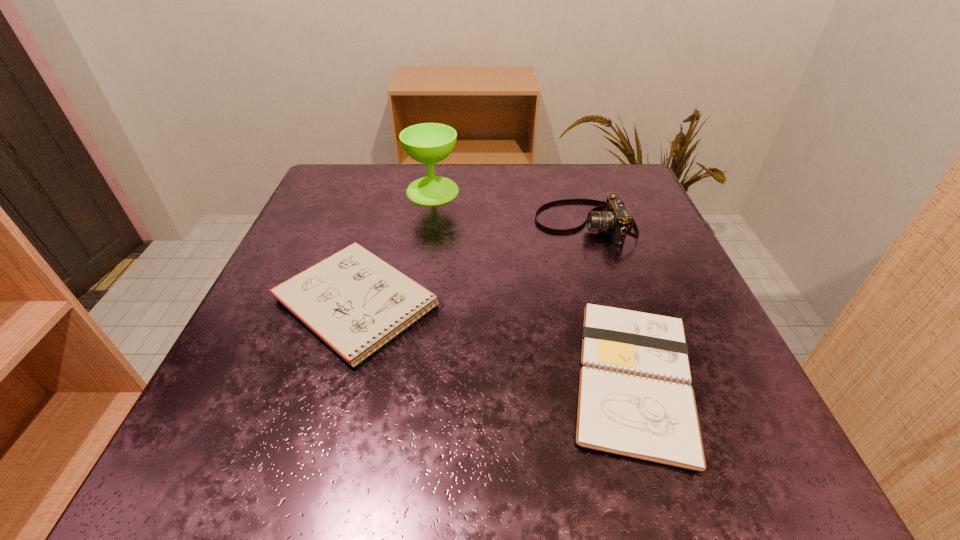
Identify the location of wineglass. This screenshot has height=540, width=960. (428, 143).

Image resolution: width=960 pixels, height=540 pixels. I want to click on camera, so click(x=615, y=218).

At what (x,y) coordinates should I click in order to perform the action: click on the left notepad. Please return your answer as a coordinate pair (x, y). The width and height of the screenshot is (960, 540). Looking at the image, I should click on (353, 300).

Identify the location of the taller notepad. The image size is (960, 540). (353, 300).

The width and height of the screenshot is (960, 540). Identify the location of the shorter notepad. (635, 399).

At what (x,y) coordinates should I click in order to perform the action: click on the right notepad. Please return your answer as a coordinate pair (x, y). Looking at the image, I should click on (635, 399).

Where is `vacant region located on the right of the wineglass`? vacant region located on the right of the wineglass is located at coordinates (493, 191).

This screenshot has height=540, width=960. Find the location of `vacant area situated 0.160m on the front-facing side of the third shortest object`. vacant area situated 0.160m on the front-facing side of the third shortest object is located at coordinates (459, 224).

The height and width of the screenshot is (540, 960). What are the coordinates of `blank area located on the front-facing side of the third shortest object` in the screenshot? It's located at (488, 224).

The height and width of the screenshot is (540, 960). Find the location of `vacant point located on the front-facing side of the third shortest object`. vacant point located on the front-facing side of the third shortest object is located at coordinates (444, 224).